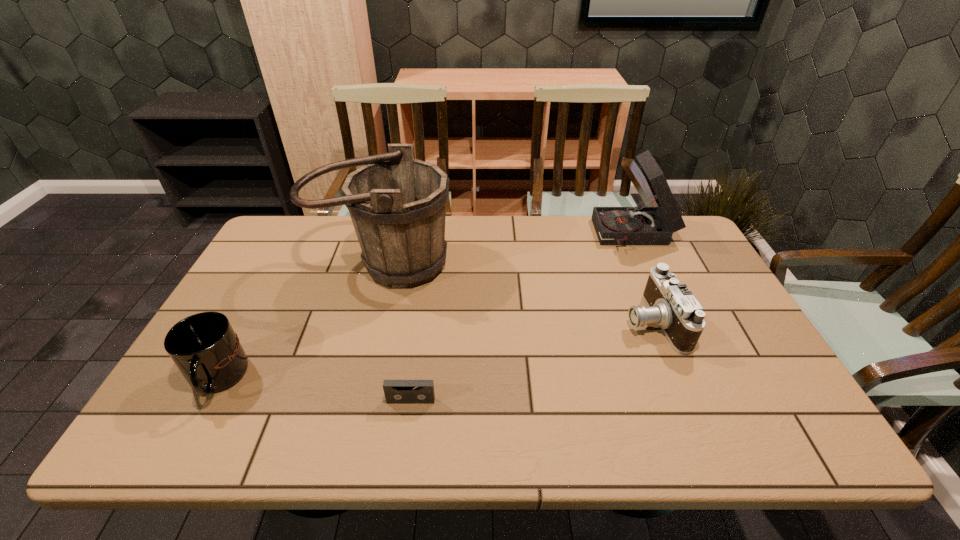
Locate an element on the screen. The width and height of the screenshot is (960, 540). unoccupied position between the second tallest object and the camera is located at coordinates (644, 279).

Locate an element on the screen. The height and width of the screenshot is (540, 960). vacant area that lies between the phonograph_record and the leftmost object is located at coordinates (426, 307).

At what (x,y) coordinates should I click in order to perform the action: click on empty space between the leftmost object and the bucket. Please return your answer as a coordinate pair (x, y). Image resolution: width=960 pixels, height=540 pixels. Looking at the image, I should click on point(300,321).

The image size is (960, 540). In order to click on object that is the second nearest to the bucket in this screenshot , I will do `click(396, 391)`.

Select which object appears as the fourth closest to the leftmost object. Please provide its 2D coordinates. Your answer should be formatted as a tuple, i.e. [(x, y)], where the tuple contains the x and y coordinates of a point satisfying the conditions above.

[(636, 225)]

This screenshot has width=960, height=540. I want to click on free space in the image that satisfies the following two spatial constraints: 1. on the front-facing side of the fourth shortest object; 2. with the handle on the side of the leftmost object, so [701, 379].

Locate an element on the screen. This screenshot has height=540, width=960. vacant region that satisfies the following two spatial constraints: 1. on the front-facing side of the phonograph_record; 2. with the handle on the side of the leftmost object is located at coordinates (701, 379).

Identify the location of vacant area in the image that satisfies the following two spatial constraints: 1. at the lens of the camera; 2. with the handle on the side of the mug. click(676, 379).

Find the location of a particular element. The image size is (960, 540). free spot that satisfies the following two spatial constraints: 1. on the front-facing side of the phonograph_record; 2. on the handle side of the tallest object is located at coordinates (648, 263).